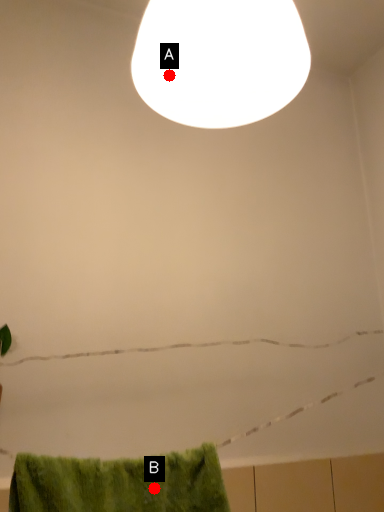
Question: Two points are circled on the image, labeled by A and B beside each circle. Which point appears farthest from the camera in this image?

Choices:
 (A) A is further
 (B) B is further

Answer: (B)